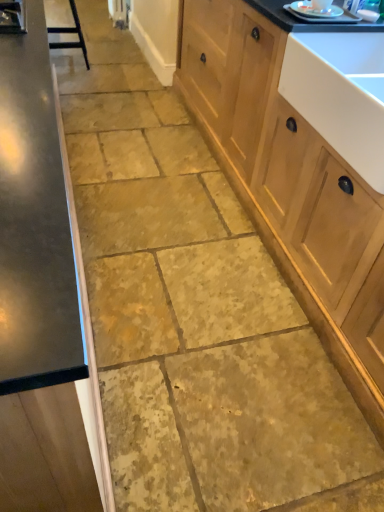
Question: Is black metal bar stool at upper left positioned beyond the bounds of satin wood cabinet at left, the 1th cabinetry in the left-to-right sequence?

Choices:
 (A) yes
 (B) no

Answer: (A)

Question: From the image's perspective, does black metal bar stool at upper left appear lower than satin wood cabinet at left, which ranks as the 2th cabinetry in right-to-left order?

Choices:
 (A) yes
 (B) no

Answer: (B)

Question: Is satin wood cabinet at left, the 1th cabinetry in the left-to-right sequence, at the back of black metal bar stool at upper left?

Choices:
 (A) yes
 (B) no

Answer: (B)

Question: Can you confirm if black metal bar stool at upper left is bigger than satin wood cabinet at left, the 1th cabinetry in the left-to-right sequence?

Choices:
 (A) yes
 (B) no

Answer: (B)

Question: Is black metal bar stool at upper left closer to camera compared to satin wood cabinet at left, the 1th cabinetry in the left-to-right sequence?

Choices:
 (A) yes
 (B) no

Answer: (B)

Question: Is black metal bar stool at upper left bigger or smaller than satin wood cabinet at left, which ranks as the 2th cabinetry in right-to-left order?

Choices:
 (A) small
 (B) big

Answer: (A)

Question: Do you think black metal bar stool at upper left is within satin wood cabinet at left, the 1th cabinetry in the left-to-right sequence, or outside of it?

Choices:
 (A) outside
 (B) inside

Answer: (A)

Question: From the image's perspective, is black metal bar stool at upper left positioned above or below satin wood cabinet at left, which ranks as the 2th cabinetry in right-to-left order?

Choices:
 (A) below
 (B) above

Answer: (B)

Question: From their relative heights in the image, would you say black metal bar stool at upper left is taller or shorter than satin wood cabinet at left, the 1th cabinetry in the left-to-right sequence?

Choices:
 (A) tall
 (B) short

Answer: (B)

Question: Is white glossy sink at upper right in front of or behind satin wood cabinet at left, the 1th cabinetry in the left-to-right sequence, in the image?

Choices:
 (A) front
 (B) behind

Answer: (B)

Question: From the image's perspective, is white glossy sink at upper right located above or below satin wood cabinet at left, the 1th cabinetry in the left-to-right sequence?

Choices:
 (A) above
 (B) below

Answer: (B)

Question: Visually, is white glossy sink at upper right positioned to the left or to the right of satin wood cabinet at left, the 1th cabinetry in the left-to-right sequence?

Choices:
 (A) left
 (B) right

Answer: (B)

Question: Considering the positions of white glossy sink at upper right and satin wood cabinet at left, which ranks as the 2th cabinetry in right-to-left order, in the image, is white glossy sink at upper right wider or thinner than satin wood cabinet at left, which ranks as the 2th cabinetry in right-to-left order,?

Choices:
 (A) thin
 (B) wide

Answer: (B)

Question: From the image's perspective, relative to black metal bar stool at upper left, is wooden cabinet at right, placed as the first cabinetry when sorted from right to left, above or below?

Choices:
 (A) below
 (B) above

Answer: (A)

Question: Does point (286, 238) appear closer or farther from the camera than point (74, 28)?

Choices:
 (A) farther
 (B) closer

Answer: (B)